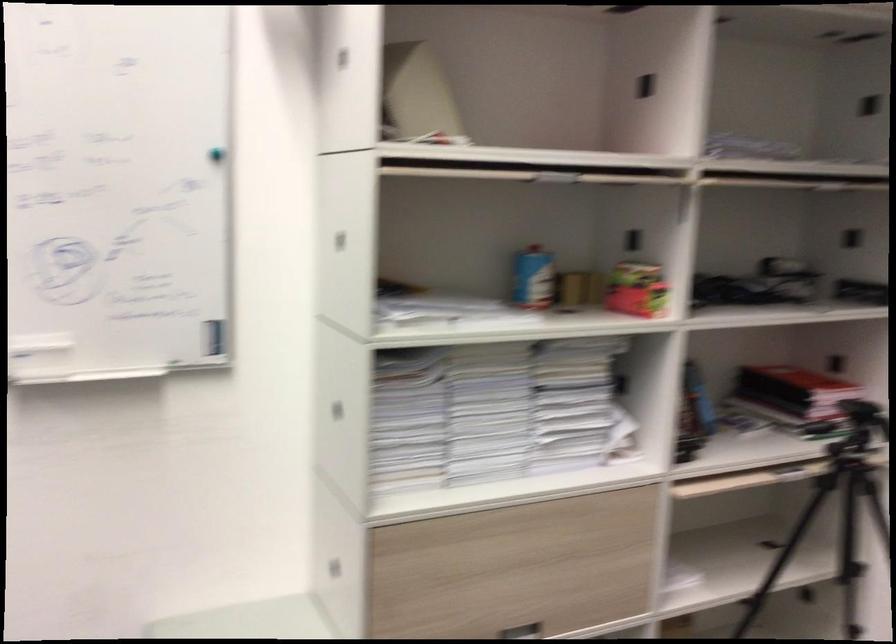
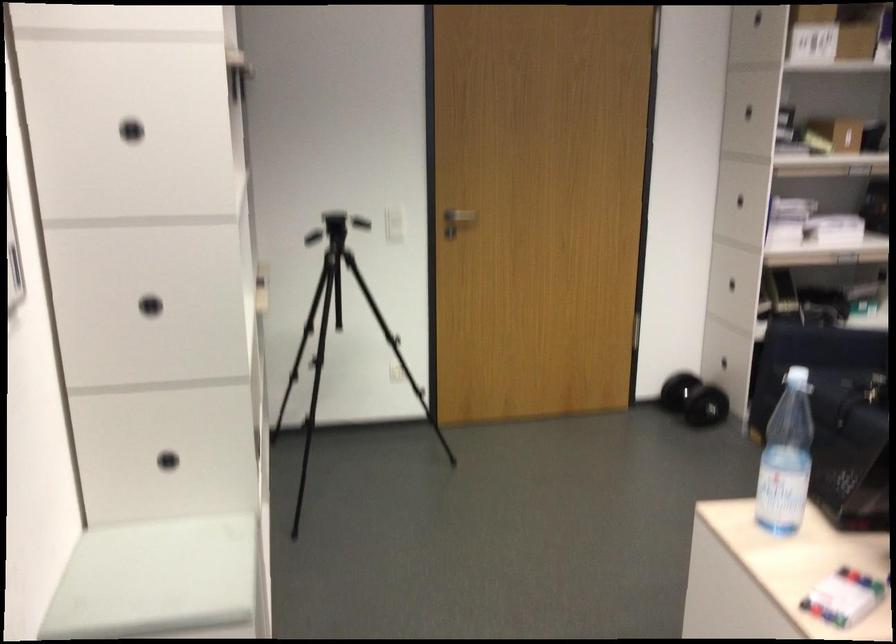
Question: I am providing you with two images of the same scene from different viewpoints. Which of the following objects are not visible in image2?

Choices:
 (A) silver door handle
 (B) blue and white can
 (C) small white bowl
 (D) black dumbbell

Answer: (B)